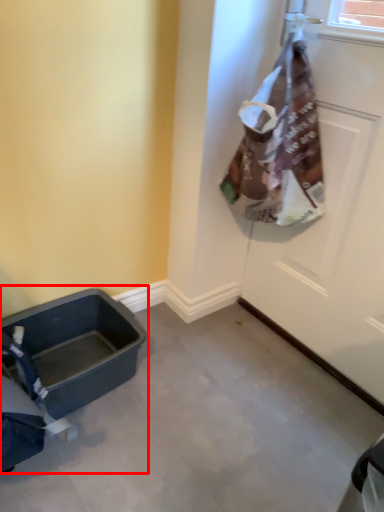
Question: From the image's perspective, considering the relative positions of baby carriage (annotated by the red box) and door in the image provided, where is baby carriage (annotated by the red box) located with respect to the staircase?

Choices:
 (A) below
 (B) above

Answer: (A)